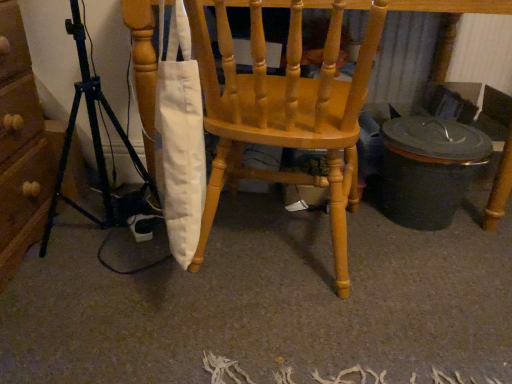
Question: Is matte wood chair at center looking in the opposite direction of black metal tripod at left?

Choices:
 (A) no
 (B) yes

Answer: (A)

Question: Is matte wood chair at center positioned in front of black metal tripod at left?

Choices:
 (A) yes
 (B) no

Answer: (B)

Question: Is matte wood chair at center at the right side of black metal tripod at left?

Choices:
 (A) yes
 (B) no

Answer: (A)

Question: Is matte wood chair at center at the left side of black metal tripod at left?

Choices:
 (A) no
 (B) yes

Answer: (A)

Question: From a real-world perspective, is matte wood chair at center physically above black metal tripod at left?

Choices:
 (A) no
 (B) yes

Answer: (B)

Question: Is matte wood chair at center directly adjacent to black metal tripod at left?

Choices:
 (A) yes
 (B) no

Answer: (B)

Question: Does black metal tripod at left have a lesser height compared to matte wood chair at center?

Choices:
 (A) no
 (B) yes

Answer: (A)

Question: Is black metal tripod at left to the right of matte wood chair at center from the viewer's perspective?

Choices:
 (A) yes
 (B) no

Answer: (B)

Question: Is black metal tripod at left behind matte wood chair at center?

Choices:
 (A) yes
 (B) no

Answer: (B)

Question: From the image's perspective, is black metal tripod at left below matte wood chair at center?

Choices:
 (A) no
 (B) yes

Answer: (B)

Question: Does black metal tripod at left have a larger size compared to matte wood chair at center?

Choices:
 (A) yes
 (B) no

Answer: (B)

Question: From the image's perspective, is black metal tripod at left on top of matte wood chair at center?

Choices:
 (A) no
 (B) yes

Answer: (A)

Question: Is matte wood chair at center inside the boundaries of black metal tripod at left, or outside?

Choices:
 (A) inside
 (B) outside

Answer: (B)